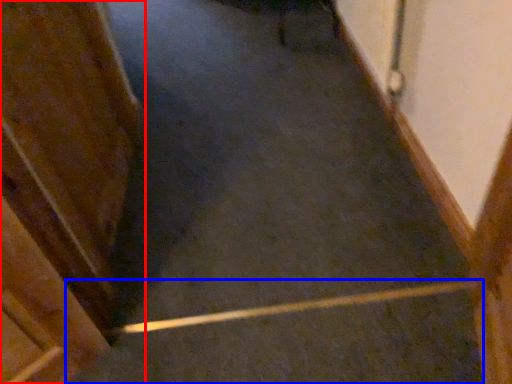
Question: Which object is closer to the camera taking this photo, door (highlighted by a red box) or stairs (highlighted by a blue box)?

Choices:
 (A) door
 (B) stairs

Answer: (A)